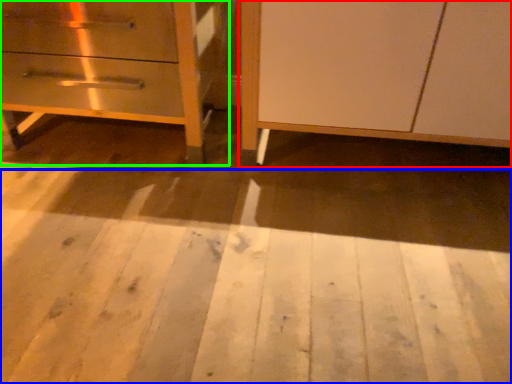
Question: Which is farther away from furniture (highlighted by a red box)? plywood (highlighted by a blue box) or chest of drawers (highlighted by a green box)?

Choices:
 (A) plywood
 (B) chest of drawers

Answer: (B)